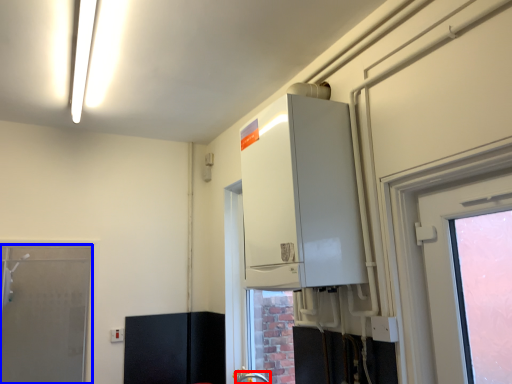
Question: Which object is closer to the camera taking this photo, faucet (highlighted by a red box) or door (highlighted by a blue box)?

Choices:
 (A) faucet
 (B) door

Answer: (A)